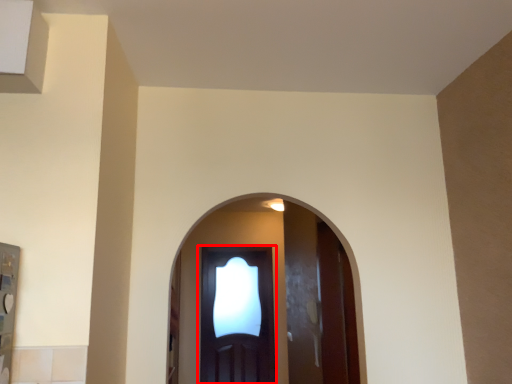
Question: From the image's perspective, considering the relative positions of door (annotated by the red box) and screen door in the image provided, where is door (annotated by the red box) located with respect to the staircase?

Choices:
 (A) below
 (B) above

Answer: (B)